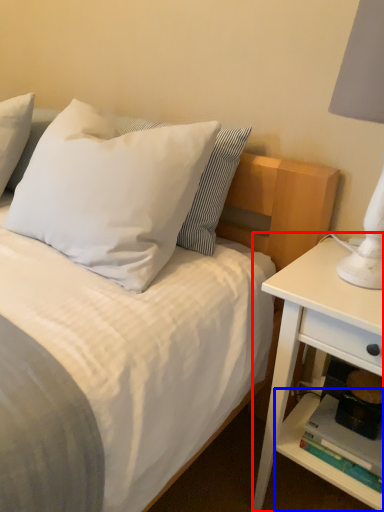
Question: Which of the following is the closest to the observer, nightstand (highlighted by a red box) or shelf (highlighted by a blue box)?

Choices:
 (A) nightstand
 (B) shelf

Answer: (A)